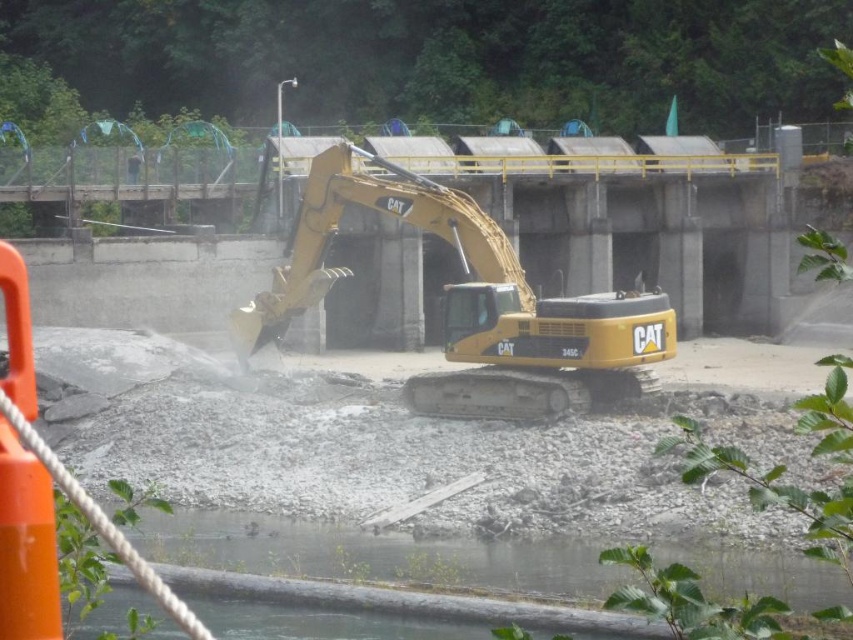
Can you confirm if gray gravel at center is thinner than clear water at lower center?

In fact, gray gravel at center might be wider than clear water at lower center.

Which is more to the right, gray gravel at center or clear water at lower center?

gray gravel at center

In the scene shown: Who is more forward, (740, 440) or (827, 604)?

Point (827, 604)

This screenshot has height=640, width=853. Find the location of `gray gravel at center`. gray gravel at center is located at coordinates (497, 461).

Between yellow metallic excavator at center and clear water at lower center, which one is positioned lower?

Positioned lower is clear water at lower center.

Who is taller, yellow metallic excavator at center or clear water at lower center?

clear water at lower center

Between point (245, 326) and point (236, 554), which one is positioned in front?

Point (236, 554)

Locate an element on the screen. yellow metallic excavator at center is located at coordinates (473, 307).

Can you confirm if gray gravel at center is positioned to the right of yellow metallic excavator at center?

Yes, gray gravel at center is to the right of yellow metallic excavator at center.

Which is in front, point (236, 435) or point (550, 330)?

Point (236, 435) is in front.

Which is behind, point (281, 432) or point (445, 385)?

Point (445, 385)

Where is `gray gravel at center`? gray gravel at center is located at coordinates (497, 461).